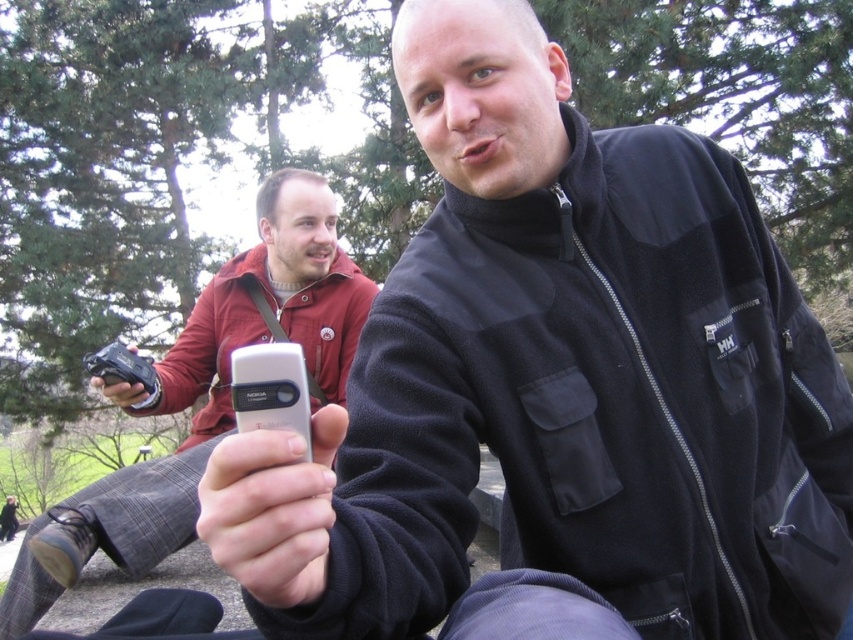
You are standing in the scene and want to hand the silver metallic phone at center to the person wearing the matte black jacket at upper right. Can you directly hand it to them without moving the phone from its current position?

The matte black jacket at upper right is located below the silver metallic phone at center, so the phone is above the jacket. Since the phone is already positioned above the jacket, you can directly hand it to the person without moving the phone from its current position.

You are standing in front of the scene and want to reach the matte black jacket at upper right. If your maximum reaching distance is 5 feet, can you grab it without moving your feet?

The matte black jacket at upper right is 6.02 feet away from the viewer, which is beyond your maximum reaching distance of 5 feet. You cannot grab it without moving your feet.